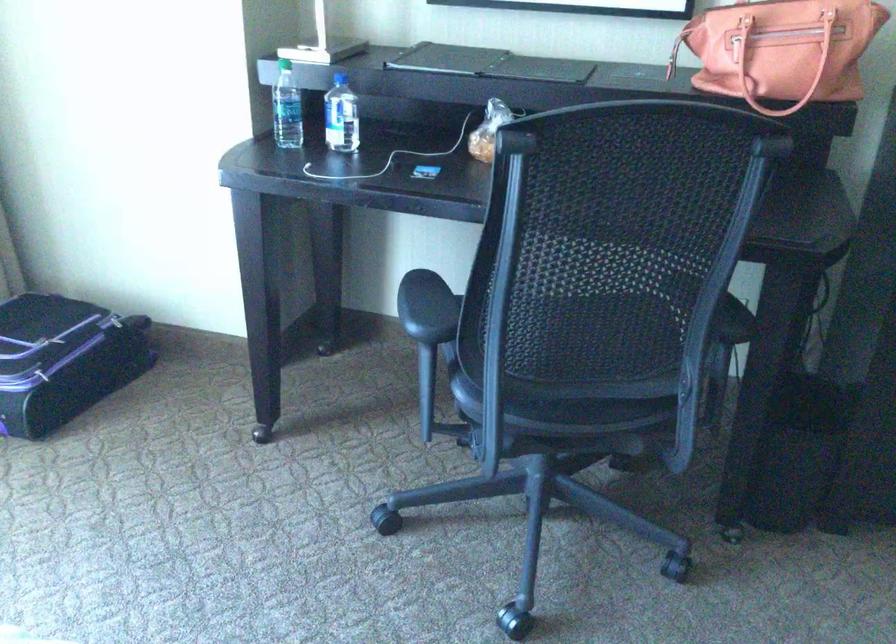
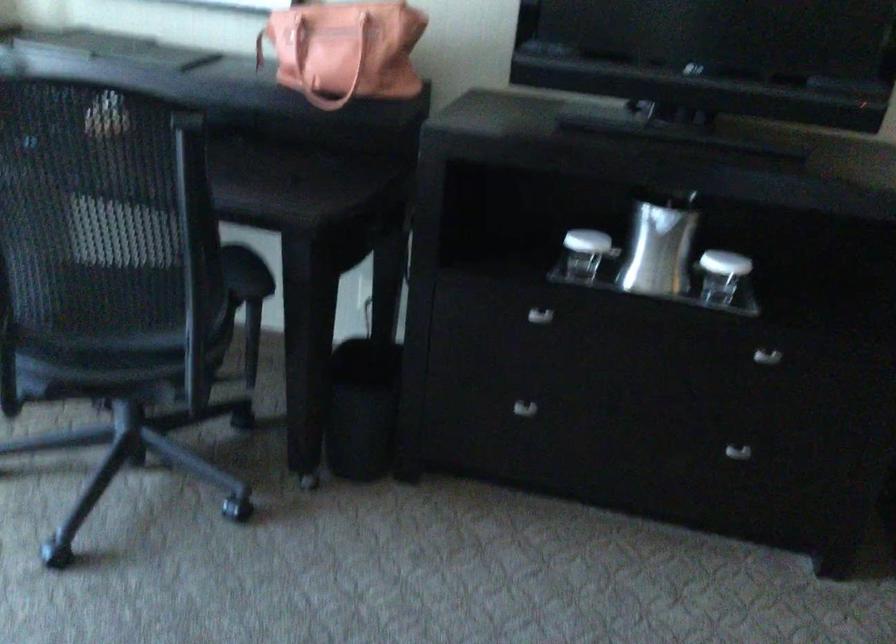
Where in the second image is the point corresponding to [602,305] from the first image?

(107, 265)